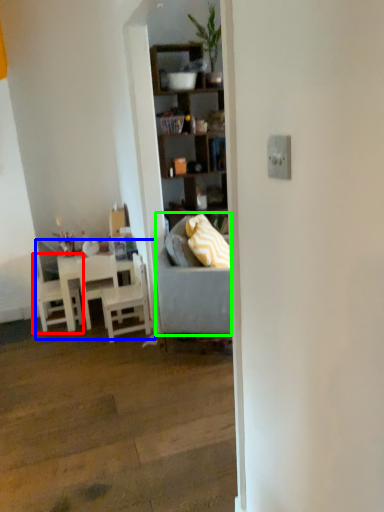
Question: Considering the real-world distances, which object is closest to chair (highlighted by a red box)? kitchen & dining room table (highlighted by a blue box) or studio couch (highlighted by a green box).

Choices:
 (A) kitchen & dining room table
 (B) studio couch

Answer: (A)